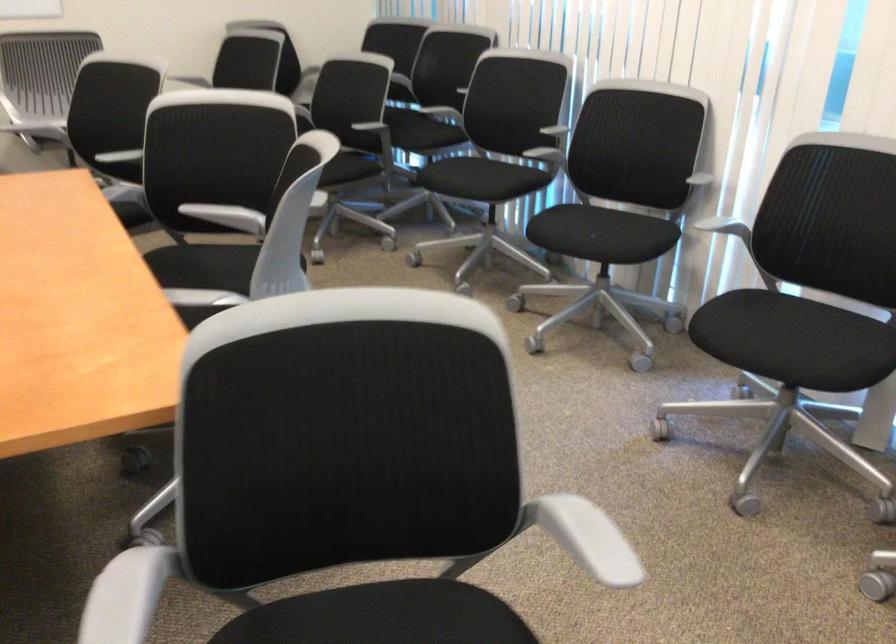
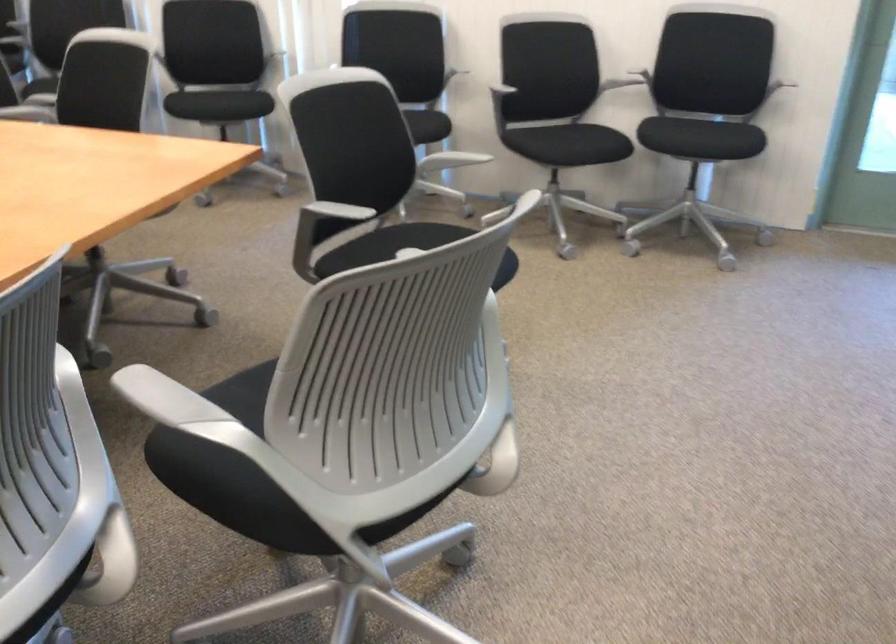
Question: I am providing you with two images of the same scene from different viewpoints. After the viewpoint changes to image2, which objects are now occluded?

Choices:
 (A) gray chair armrest
 (B) black chair sitting surface
 (C) small grey fan
 (D) gray adjustment knob

Answer: (B)